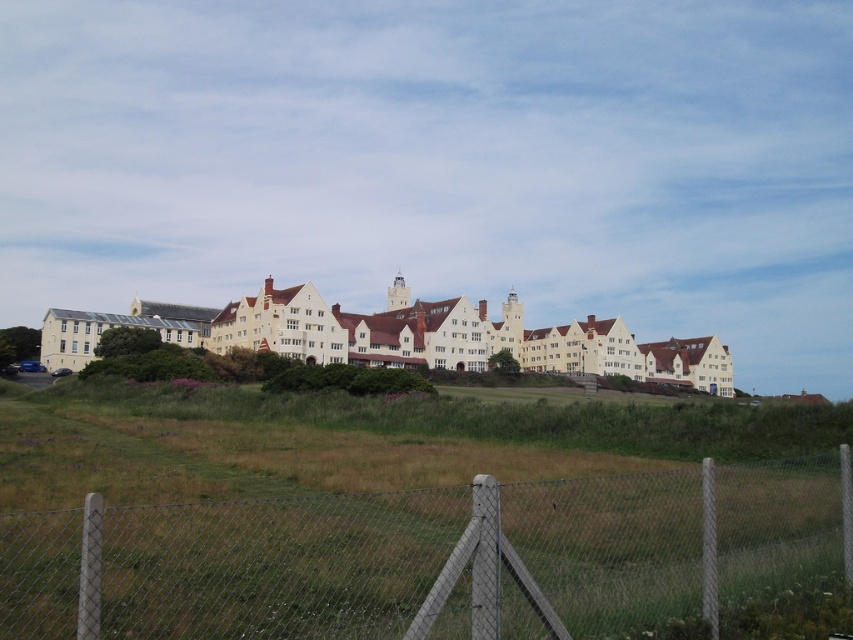
Does gray chain-link fence at center appear under white matte building at center?

Correct, gray chain-link fence at center is located below white matte building at center.

Is gray chain-link fence at center closer to camera compared to white matte building at center?

Yes, gray chain-link fence at center is closer to the viewer.

Is point (141, 563) farther from viewer compared to point (132, 310)?

No, (141, 563) is in front of (132, 310).

At what (x,y) coordinates should I click in order to perform the action: click on gray chain-link fence at center. Please return your answer as a coordinate pair (x, y). Image resolution: width=853 pixels, height=640 pixels. Looking at the image, I should click on (431, 557).